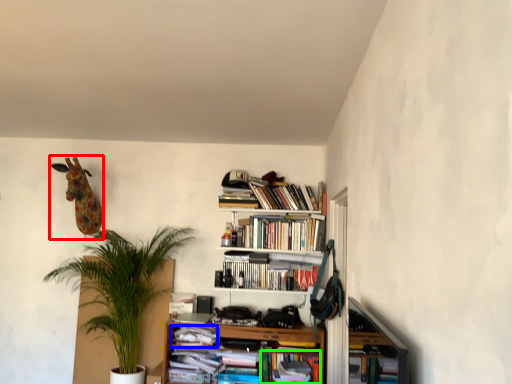
Question: Estimate the real-world distances between objects in this image. Which object is farther from animal (highlighted by a red box), book (highlighted by a blue box) or book (highlighted by a green box)?

Choices:
 (A) book
 (B) book

Answer: (B)